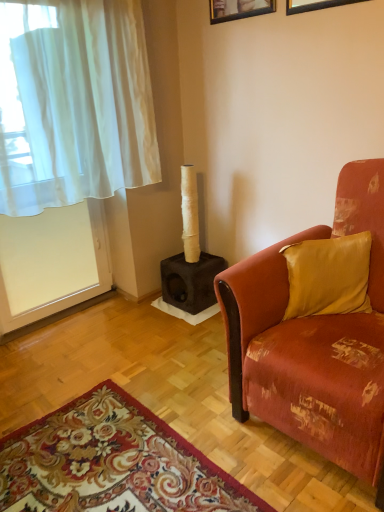
What do you see at coordinates (112, 463) in the screenshot? The image size is (384, 512). I see `floral carpet at lower left` at bounding box center [112, 463].

Identify the location of wooden picture frame at upper center, which is the 1th picture frame from back to front. (238, 9).

Describe the element at coordinates (328, 275) in the screenshot. The width and height of the screenshot is (384, 512). I see `silky gold pillow at right` at that location.

Where is `black matte picture frame at upper center, which is the second picture frame from left to right`? The image size is (384, 512). black matte picture frame at upper center, which is the second picture frame from left to right is located at coordinates [x=314, y=5].

You are a GUI agent. You are given a task and a screenshot of the screen. Output one action in this format:
    pyautogui.click(x=<x>, y=<y>)
    Task: Click on the velvet orange couch at right
    The height and width of the screenshot is (512, 384).
    Given the screenshot: What is the action you would take?
    pyautogui.click(x=314, y=342)

What do you see at coordinates (314, 342) in the screenshot? This screenshot has width=384, height=512. I see `velvet orange couch at right` at bounding box center [314, 342].

In order to click on floral carpet at lower left in this screenshot , I will do `click(112, 463)`.

Considering the sizes of objects floral carpet at lower left and black matte picture frame at upper center, which ranks as the 1th picture frame in front-to-back order, in the image provided, who is smaller, floral carpet at lower left or black matte picture frame at upper center, which ranks as the 1th picture frame in front-to-back order,?

black matte picture frame at upper center, which ranks as the 1th picture frame in front-to-back order.

Does point (47, 504) appear closer or farther from the camera than point (286, 8)?

Clearly, point (47, 504) is closer to the camera than point (286, 8).

In terms of width, does floral carpet at lower left look wider or thinner when compared to black matte picture frame at upper center, the first picture frame when ordered from right to left?

floral carpet at lower left is wider than black matte picture frame at upper center, the first picture frame when ordered from right to left.

From a real-world perspective, is floral carpet at lower left over black matte picture frame at upper center, which ranks as the 1th picture frame in front-to-back order?

No.

From the image's perspective, who appears lower, white sheer curtain at left or velvet orange couch at right?

velvet orange couch at right, from the image's perspective.

Is white sheer curtain at left positioned behind velvet orange couch at right?

That is True.

Is velvet orange couch at right at the back of white sheer curtain at left?

white sheer curtain at left does not have its back to velvet orange couch at right.

Is there a large distance between white sheer curtain at left and velvet orange couch at right?

Yes, white sheer curtain at left and velvet orange couch at right are quite far apart.

Where is `the 1st picture frame to the left of the velvet orange couch at right, counting from the anchor's position`? This screenshot has width=384, height=512. the 1st picture frame to the left of the velvet orange couch at right, counting from the anchor's position is located at coordinates (314, 5).

Is black matte picture frame at upper center, the first picture frame when ordered from right to left, a part of velvet orange couch at right?

No, black matte picture frame at upper center, the first picture frame when ordered from right to left, is located outside of velvet orange couch at right.

Can you tell me how much velvet orange couch at right and black matte picture frame at upper center, which is the second picture frame from left to right, differ in facing direction?

They differ by 0.0191 degrees in their facing directions.

Looking at this image, can you confirm if velvet orange couch at right is thinner than black matte picture frame at upper center, which ranks as the 1th picture frame in front-to-back order?

No, velvet orange couch at right is not thinner than black matte picture frame at upper center, which ranks as the 1th picture frame in front-to-back order.

Considering the relative positions of velvet orange couch at right and floral carpet at lower left in the image provided, is velvet orange couch at right to the right of floral carpet at lower left from the viewer's perspective?

Correct, you'll find velvet orange couch at right to the right of floral carpet at lower left.

Is velvet orange couch at right looking in the opposite direction of floral carpet at lower left?

No, velvet orange couch at right's orientation is not away from floral carpet at lower left.

Where is `studio couch located on the right of floral carpet at lower left`? This screenshot has height=512, width=384. studio couch located on the right of floral carpet at lower left is located at coordinates (314, 342).

Is point (382, 167) closer or farther from the camera than point (62, 421)?

Point (382, 167) is positioned closer to the camera compared to point (62, 421).

Can silky gold pillow at right be found inside wooden picture frame at upper center, which is the 1th picture frame from back to front?

No, silky gold pillow at right is not inside wooden picture frame at upper center, which is the 1th picture frame from back to front.

Is point (260, 11) closer to camera compared to point (322, 281)?

No, (260, 11) is behind (322, 281).

From the picture: Is wooden picture frame at upper center, which is the 1th picture frame from back to front, to the left of silky gold pillow at right from the viewer's perspective?

Yes, wooden picture frame at upper center, which is the 1th picture frame from back to front, is to the left of silky gold pillow at right.

Is wooden picture frame at upper center, which appears as the 1th picture frame when viewed from the left, bigger than velvet orange couch at right?

Actually, wooden picture frame at upper center, which appears as the 1th picture frame when viewed from the left, might be smaller than velvet orange couch at right.

From a real-world perspective, which is physically above, wooden picture frame at upper center, placed as the second picture frame when sorted from front to back, or velvet orange couch at right?

wooden picture frame at upper center, placed as the second picture frame when sorted from front to back.

Considering the relative sizes of wooden picture frame at upper center, which appears as the 1th picture frame when viewed from the left, and velvet orange couch at right in the image provided, is wooden picture frame at upper center, which appears as the 1th picture frame when viewed from the left, taller than velvet orange couch at right?

No, wooden picture frame at upper center, which appears as the 1th picture frame when viewed from the left, is not taller than velvet orange couch at right.

Visually, is wooden picture frame at upper center, which appears as the 1th picture frame when viewed from the left, positioned to the left or to the right of velvet orange couch at right?

wooden picture frame at upper center, which appears as the 1th picture frame when viewed from the left, is positioned on velvet orange couch at right's left side.

Who is smaller, wooden picture frame at upper center, which appears as the 1th picture frame when viewed from the left, or white sheer curtain at left?

wooden picture frame at upper center, which appears as the 1th picture frame when viewed from the left, is smaller.

Locate an element on the screen. This screenshot has width=384, height=512. curtain on the left of wooden picture frame at upper center, which is the 1th picture frame from back to front is located at coordinates (80, 109).

In terms of width, does wooden picture frame at upper center, the second picture frame when ordered from right to left, look wider or thinner when compared to white sheer curtain at left?

wooden picture frame at upper center, the second picture frame when ordered from right to left, is thinner than white sheer curtain at left.

Can you tell me how much wooden picture frame at upper center, which is the 1th picture frame from back to front, and white sheer curtain at left differ in facing direction?

The angle between the facing direction of wooden picture frame at upper center, which is the 1th picture frame from back to front, and the facing direction of white sheer curtain at left is 90.2 degrees.

Locate an element on the screen. The width and height of the screenshot is (384, 512). mat below the black matte picture frame at upper center, placed as the second picture frame when sorted from back to front (from the image's perspective) is located at coordinates (112, 463).

What are the coordinates of `curtain above the velvet orange couch at right (from a real-world perspective)` in the screenshot? It's located at (80, 109).

Considering their positions, is wooden picture frame at upper center, the second picture frame when ordered from right to left, positioned further to white sheer curtain at left than floral carpet at lower left?

Among the two, floral carpet at lower left is located further to white sheer curtain at left.

Looking at this image, looking at the image, which one is located closer to velvet orange couch at right, wooden picture frame at upper center, which appears as the 1th picture frame when viewed from the left, or white sheer curtain at left?

Based on the image, white sheer curtain at left appears to be nearer to velvet orange couch at right.

From the image, which object appears to be nearer to silky gold pillow at right, white sheer curtain at left or wooden picture frame at upper center, placed as the second picture frame when sorted from front to back?

The object closer to silky gold pillow at right is white sheer curtain at left.

Consider the image. When comparing their distances from white sheer curtain at left, does black matte picture frame at upper center, the first picture frame when ordered from right to left, or wooden picture frame at upper center, placed as the second picture frame when sorted from front to back, seem further?

black matte picture frame at upper center, the first picture frame when ordered from right to left, is positioned further to the anchor white sheer curtain at left.

Looking at the image, which one is located closer to floral carpet at lower left, silky gold pillow at right or black matte picture frame at upper center, the first picture frame when ordered from right to left?

silky gold pillow at right is closer to floral carpet at lower left.

Considering their positions, is floral carpet at lower left positioned further to silky gold pillow at right than wooden picture frame at upper center, which appears as the 1th picture frame when viewed from the left?

wooden picture frame at upper center, which appears as the 1th picture frame when viewed from the left, is further to silky gold pillow at right.

Based on their spatial positions, is black matte picture frame at upper center, placed as the second picture frame when sorted from back to front, or white sheer curtain at left further from floral carpet at lower left?

Based on the image, black matte picture frame at upper center, placed as the second picture frame when sorted from back to front, appears to be further to floral carpet at lower left.

When comparing their distances from black matte picture frame at upper center, the first picture frame when ordered from right to left, does floral carpet at lower left or white sheer curtain at left seem further?

The object further to black matte picture frame at upper center, the first picture frame when ordered from right to left, is floral carpet at lower left.

This screenshot has width=384, height=512. Find the location of `pillow between white sheer curtain at left and velvet orange couch at right`. pillow between white sheer curtain at left and velvet orange couch at right is located at coordinates (328, 275).

Where is `picture frame between wooden picture frame at upper center, which is the 1th picture frame from back to front, and silky gold pillow at right vertically`? The width and height of the screenshot is (384, 512). picture frame between wooden picture frame at upper center, which is the 1th picture frame from back to front, and silky gold pillow at right vertically is located at coordinates (314, 5).

I want to click on curtain that lies between wooden picture frame at upper center, placed as the second picture frame when sorted from front to back, and silky gold pillow at right from top to bottom, so click(x=80, y=109).

Identify the location of curtain between wooden picture frame at upper center, the second picture frame when ordered from right to left, and floral carpet at lower left vertically. (80, 109).